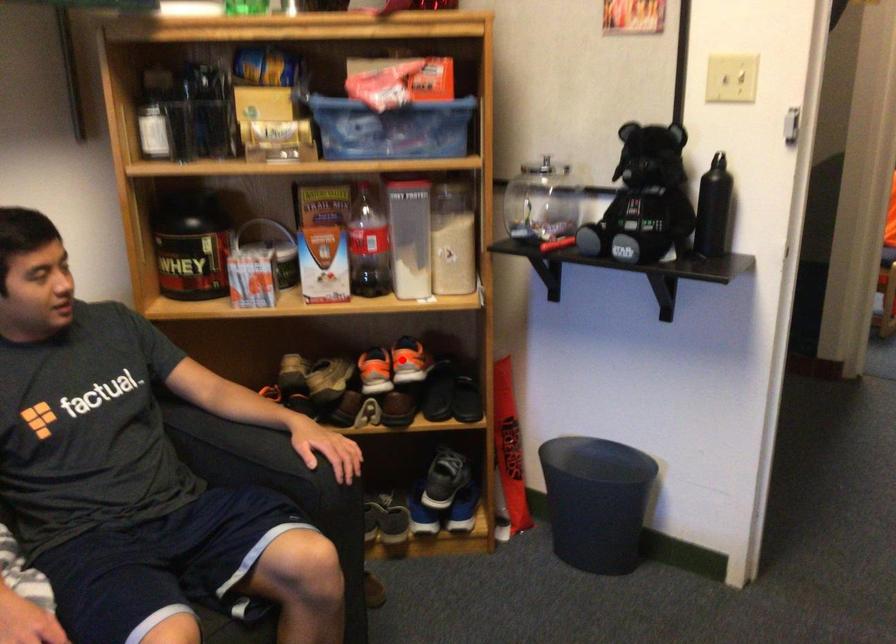
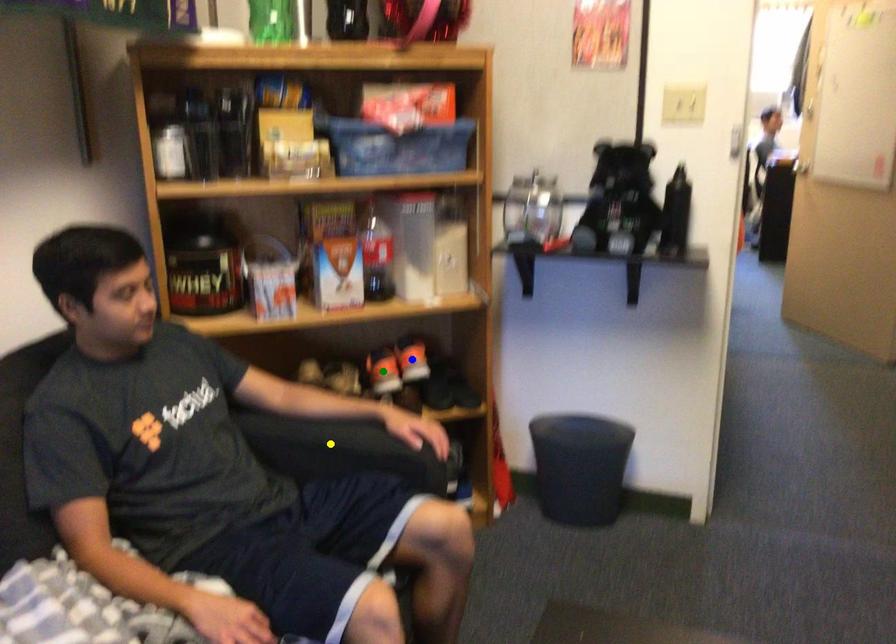
Question: I am providing you with two images of the same scene from different viewpoints. A red point is marked on the first image. You are given multiple points on the second image. Which point in image 2 represents the same 3d spot as the red point in image 1?

Choices:
 (A) blue point
 (B) yellow point
 (C) green point

Answer: (A)